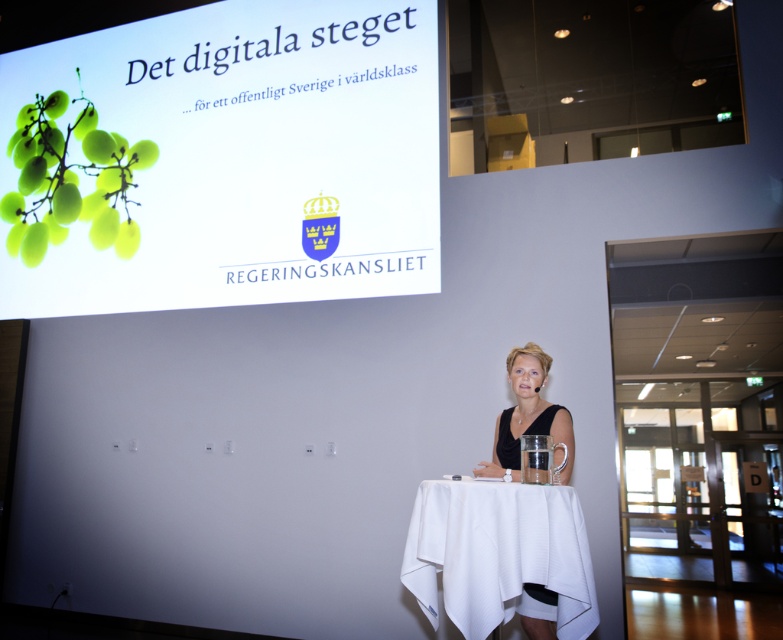
Question: Which point appears farthest from the camera in this image?

Choices:
 (A) (531, 404)
 (B) (565, 488)
 (C) (247, 141)
 (D) (511, 410)

Answer: (C)

Question: Does green matte grapes at upper left lie behind matte black dress at center?

Choices:
 (A) yes
 (B) no

Answer: (A)

Question: Which object is positioned farthest from the matte black dress at center?

Choices:
 (A) green matte grapes at upper left
 (B) white paper at upper left

Answer: (A)

Question: Is green matte grapes at upper left closer to camera compared to matte black woman at center?

Choices:
 (A) no
 (B) yes

Answer: (A)

Question: Estimate the real-world distances between objects in this image. Which object is farther from the green matte grapes at upper left?

Choices:
 (A) white cloth-covered table at center
 (B) matte black woman at center
 (C) matte black dress at center
 (D) white paper at upper left

Answer: (C)

Question: Is white cloth-covered table at center to the left of matte black woman at center from the viewer's perspective?

Choices:
 (A) no
 (B) yes

Answer: (B)